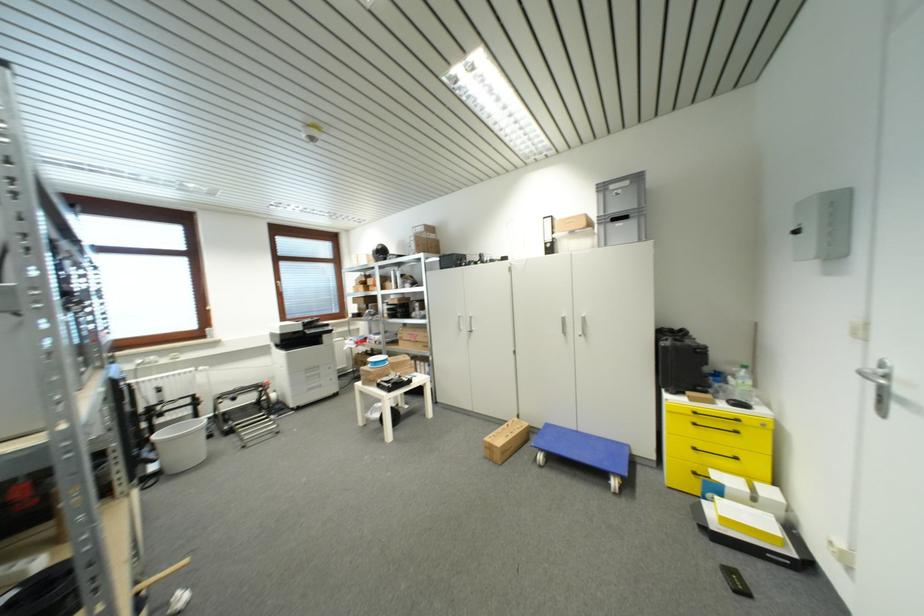
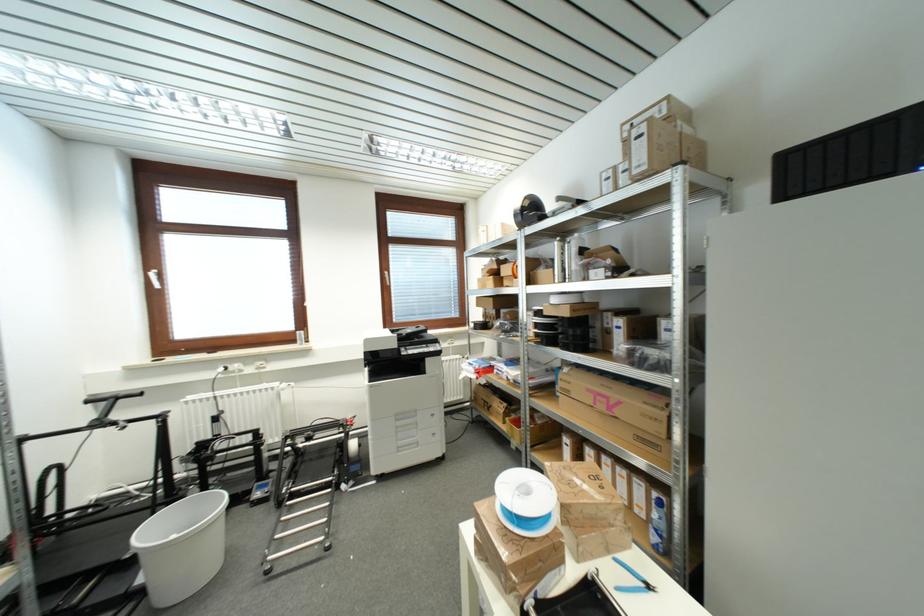
The point at [312,371] is marked in the first image. Where is the corresponding point in the second image?

(403, 419)